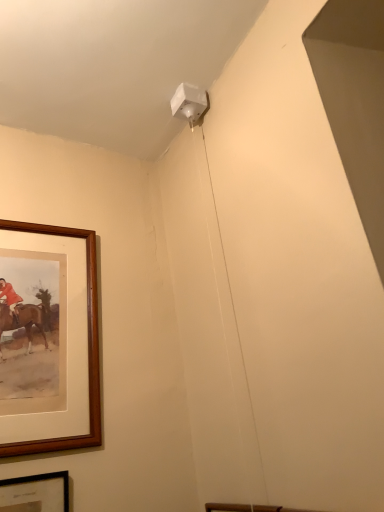
Question: Is brown wooden picture frame at left, marked as the second picture frame in a bottom-to-top arrangement, beside wooden picture frame at lower left, marked as the second picture frame in a top-to-bottom arrangement?

Choices:
 (A) no
 (B) yes

Answer: (A)

Question: From the image's perspective, is brown wooden picture frame at left, the first picture frame when ordered from top to bottom, on top of wooden picture frame at lower left, marked as the second picture frame in a top-to-bottom arrangement?

Choices:
 (A) no
 (B) yes

Answer: (B)

Question: Is brown wooden picture frame at left, marked as the second picture frame in a bottom-to-top arrangement, completely or partially outside of wooden picture frame at lower left, acting as the 1th picture frame starting from the bottom?

Choices:
 (A) yes
 (B) no

Answer: (A)

Question: Can wooden picture frame at lower left, marked as the second picture frame in a top-to-bottom arrangement, be found inside brown wooden picture frame at left, the first picture frame when ordered from top to bottom?

Choices:
 (A) yes
 (B) no

Answer: (B)

Question: Does brown wooden picture frame at left, marked as the second picture frame in a bottom-to-top arrangement, have a lesser height compared to wooden picture frame at lower left, marked as the second picture frame in a top-to-bottom arrangement?

Choices:
 (A) no
 (B) yes

Answer: (A)

Question: Is brown wooden picture frame at left, the first picture frame when ordered from top to bottom, closer to camera compared to wooden picture frame at lower left, marked as the second picture frame in a top-to-bottom arrangement?

Choices:
 (A) yes
 (B) no

Answer: (B)

Question: Is wooden picture frame at lower left, acting as the 1th picture frame starting from the bottom, aimed at brown wooden picture frame at left, marked as the second picture frame in a bottom-to-top arrangement?

Choices:
 (A) no
 (B) yes

Answer: (A)

Question: Considering the relative positions of wooden picture frame at lower left, marked as the second picture frame in a top-to-bottom arrangement, and brown wooden picture frame at left, the first picture frame when ordered from top to bottom, in the image provided, is wooden picture frame at lower left, marked as the second picture frame in a top-to-bottom arrangement, to the right of brown wooden picture frame at left, the first picture frame when ordered from top to bottom, from the viewer's perspective?

Choices:
 (A) yes
 (B) no

Answer: (B)

Question: From a real-world perspective, is wooden picture frame at lower left, acting as the 1th picture frame starting from the bottom, over brown wooden picture frame at left, the first picture frame when ordered from top to bottom?

Choices:
 (A) no
 (B) yes

Answer: (A)

Question: From the image's perspective, is wooden picture frame at lower left, marked as the second picture frame in a top-to-bottom arrangement, beneath brown wooden picture frame at left, marked as the second picture frame in a bottom-to-top arrangement?

Choices:
 (A) yes
 (B) no

Answer: (A)

Question: Can you confirm if wooden picture frame at lower left, marked as the second picture frame in a top-to-bottom arrangement, is wider than brown wooden picture frame at left, marked as the second picture frame in a bottom-to-top arrangement?

Choices:
 (A) no
 (B) yes

Answer: (A)

Question: Does wooden picture frame at lower left, marked as the second picture frame in a top-to-bottom arrangement, have a larger size compared to brown wooden picture frame at left, the first picture frame when ordered from top to bottom?

Choices:
 (A) no
 (B) yes

Answer: (A)

Question: In terms of height, does brown wooden picture frame at left, marked as the second picture frame in a bottom-to-top arrangement, look taller or shorter compared to wooden picture frame at lower left, marked as the second picture frame in a top-to-bottom arrangement?

Choices:
 (A) short
 (B) tall

Answer: (B)